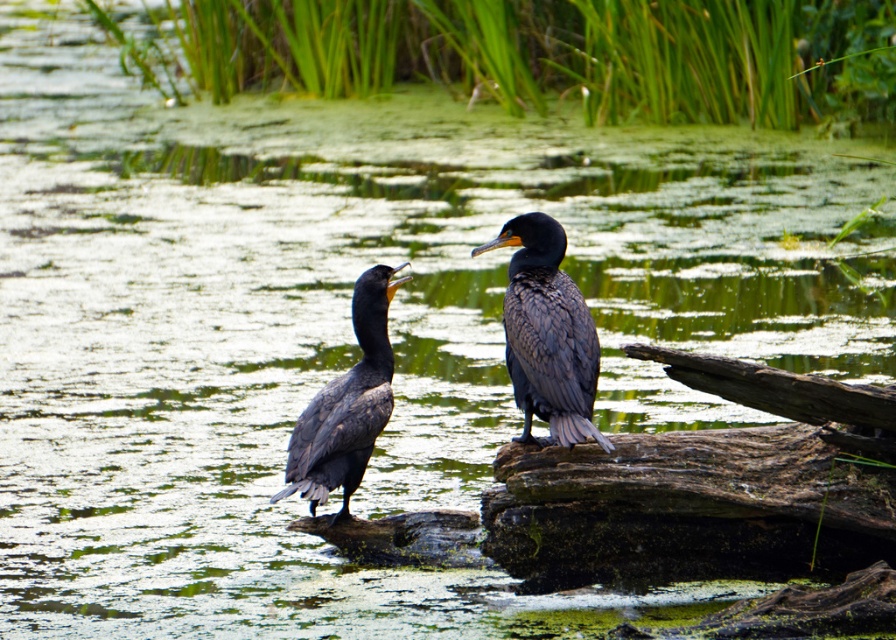
Does shiny black cormorant at center have a greater width compared to dark gray feathers at center?

Incorrect, shiny black cormorant at center's width does not surpass dark gray feathers at center's.

Measure the distance between shiny black cormorant at center and camera.

The distance of shiny black cormorant at center from camera is 6.90 meters.

Image resolution: width=896 pixels, height=640 pixels. What do you see at coordinates (547, 333) in the screenshot? I see `shiny black cormorant at center` at bounding box center [547, 333].

The image size is (896, 640). I want to click on shiny black cormorant at center, so click(547, 333).